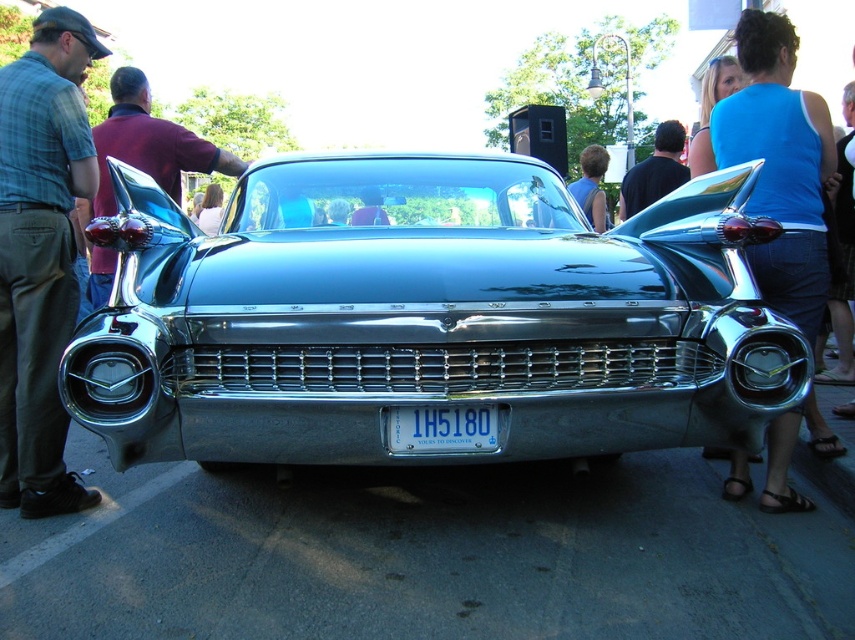
Question: Does maroon fabric shirt at left lie in front of blue metallic license plate at center?

Choices:
 (A) yes
 (B) no

Answer: (B)

Question: In this image, where is shiny chrome car at center located relative to blue metallic license plate at center?

Choices:
 (A) above
 (B) below

Answer: (A)

Question: Which of the following is the farthest from the observer?

Choices:
 (A) black fabric shirt at center
 (B) shiny chrome car at center

Answer: (A)

Question: Which point is farther to the camera?

Choices:
 (A) blue metallic license plate at center
 (B) maroon fabric shirt at left
 (C) black fabric shirt at center
 (D) green plaid shirt at left

Answer: (C)

Question: Does shiny chrome car at center appear on the right side of blue metallic license plate at center?

Choices:
 (A) no
 (B) yes

Answer: (A)

Question: Which point appears closest to the camera in this image?

Choices:
 (A) (31, 504)
 (B) (276, 432)
 (C) (433, 444)
 (D) (659, 129)

Answer: (B)